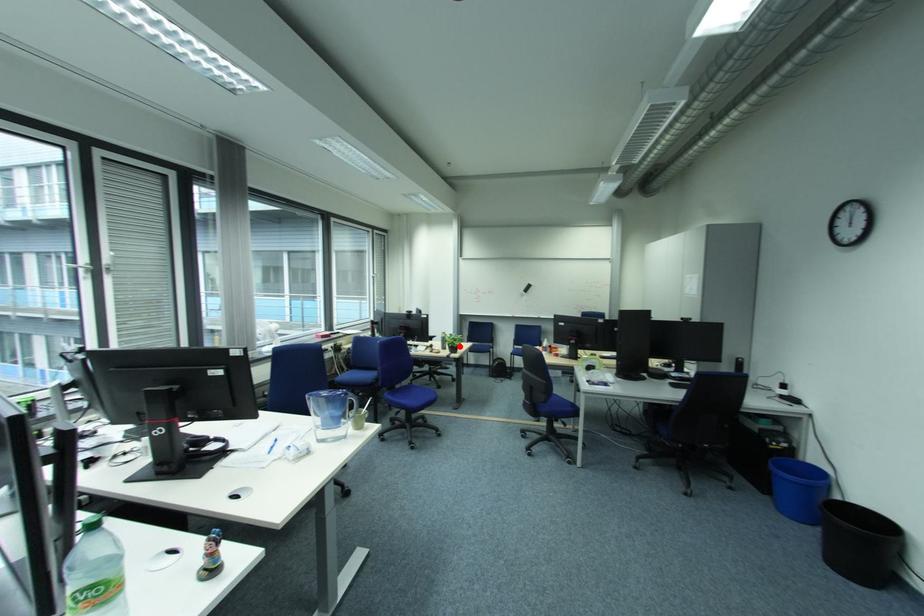
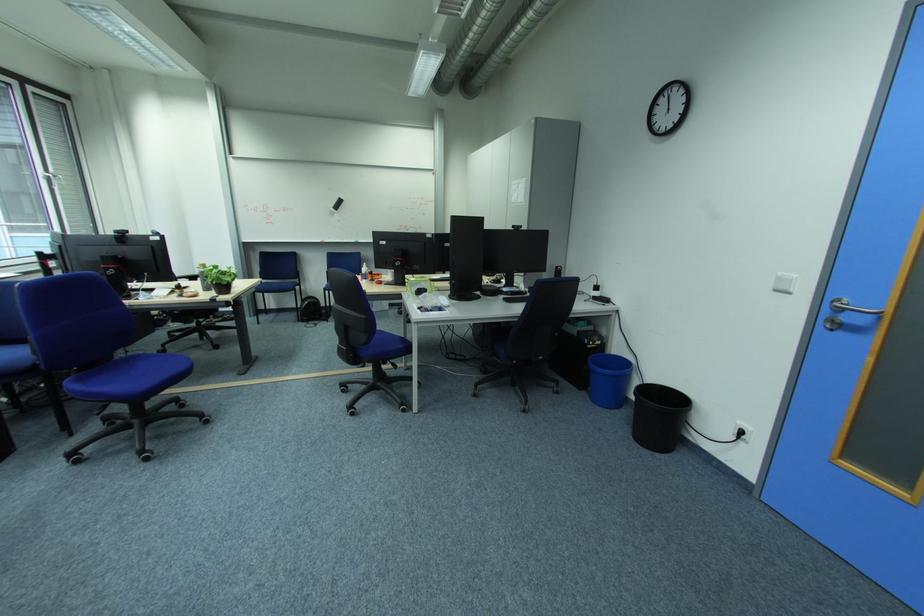
Question: I am providing you with two images of the same scene from different viewpoints. Given a red point in image1, look at the same physical point in image2. Is it:

Choices:
 (A) Closer to the viewpoint
 (B) Farther from the viewpoint

Answer: (A)